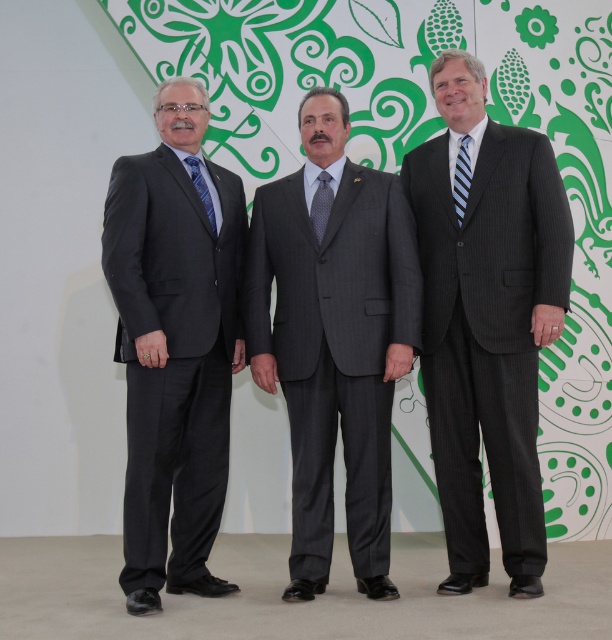
Question: Is gray pinstripe suit at center to the left of gray dotted tie at center from the viewer's perspective?

Choices:
 (A) yes
 (B) no

Answer: (B)

Question: Which point is closer to the camera?

Choices:
 (A) gray dotted tie at center
 (B) blue silk tie at center

Answer: (B)

Question: Which object is positioned closest to the gray dotted tie at center?

Choices:
 (A) gray pinstripe suit at center
 (B) matte black suit at left
 (C) striped fabric tie at center

Answer: (A)

Question: Is pinstriped suit at center behind striped fabric tie at center?

Choices:
 (A) no
 (B) yes

Answer: (A)

Question: Can you confirm if gray pinstripe suit at center is positioned to the left of blue silk tie at center?

Choices:
 (A) yes
 (B) no

Answer: (B)

Question: Estimate the real-world distances between objects in this image. Which object is farther from the pinstriped suit at center?

Choices:
 (A) gray pinstripe suit at center
 (B) matte black suit at left
 (C) gray dotted tie at center

Answer: (B)